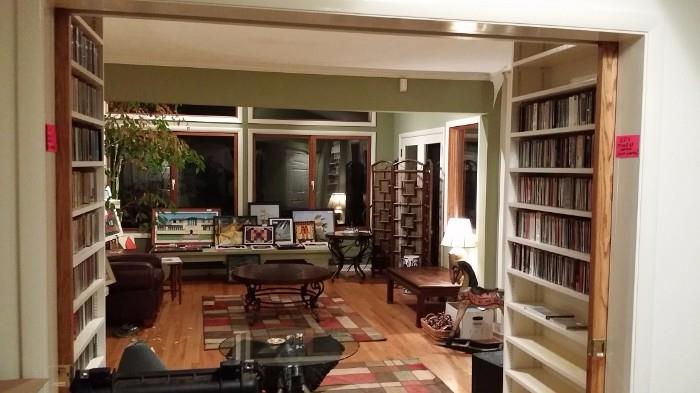
At what (x,y) coordinates should I click in order to perform the action: click on rectangular table. Please return your answer as a coordinate pair (x, y). The image size is (700, 393). Looking at the image, I should click on (416, 276).